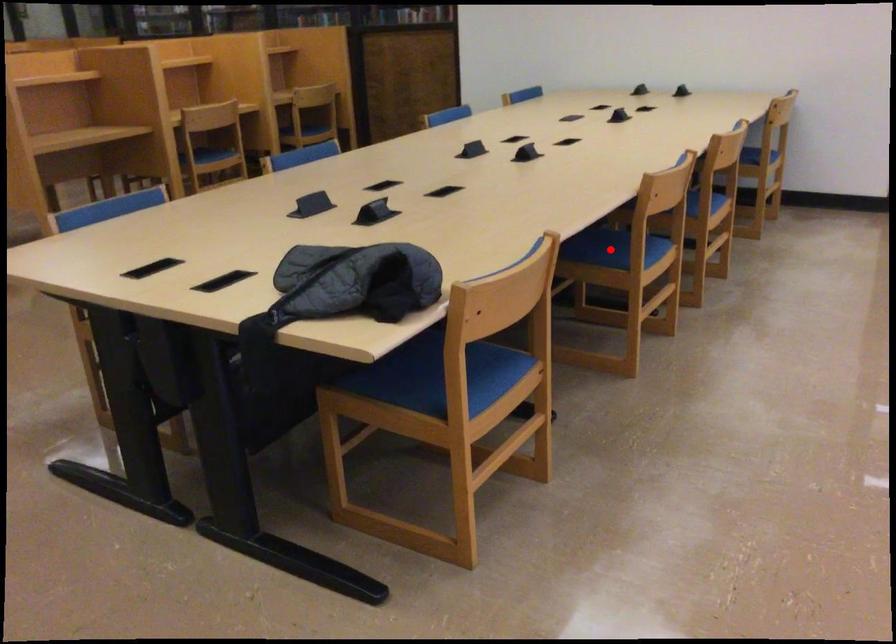
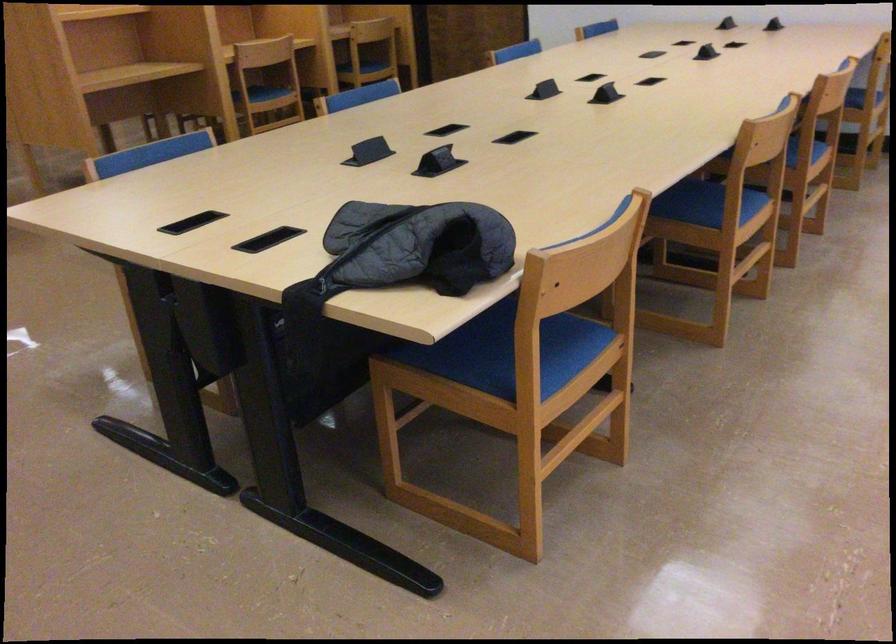
In the second image, find the point that corresponds to the highlighted location in the first image.

(702, 204)